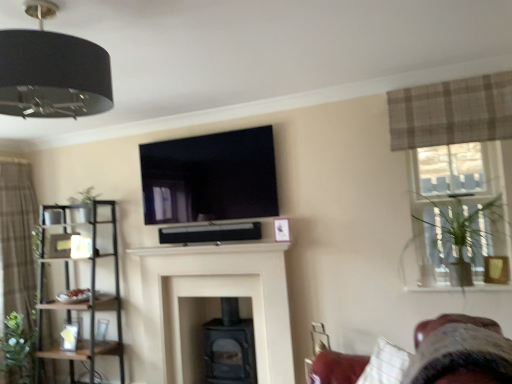
I want to click on empty space that is ontop of white matte fireplace at center (from a real-world perspective), so click(211, 245).